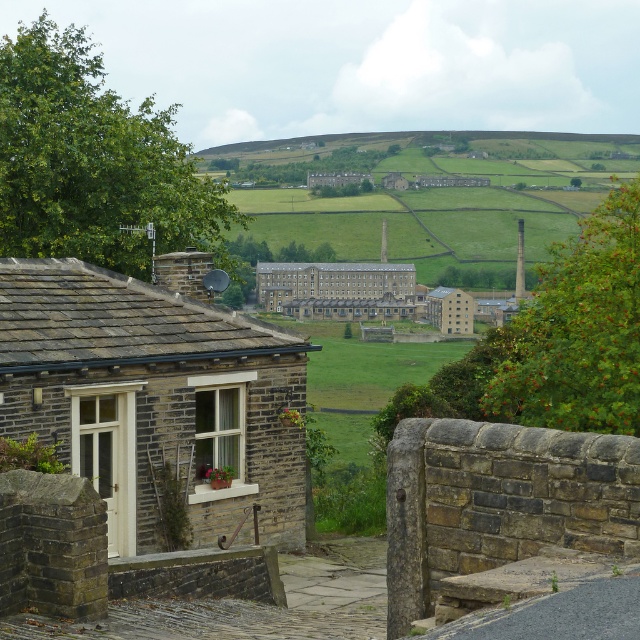
Does brown brick cottage at lower left have a greater width compared to brown stone building at center?

Yes, brown brick cottage at lower left is wider than brown stone building at center.

Does point (109, 320) come in front of point (465, 296)?

Yes.

Image resolution: width=640 pixels, height=640 pixels. I want to click on brown brick cottage at lower left, so click(x=154, y=397).